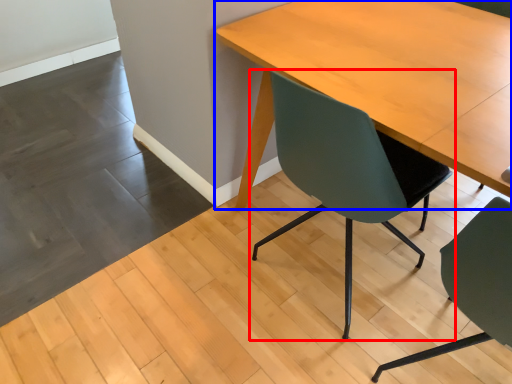
Question: Among these objects, which one is farthest to the camera, chair (highlighted by a red box) or table (highlighted by a blue box)?

Choices:
 (A) chair
 (B) table

Answer: (A)